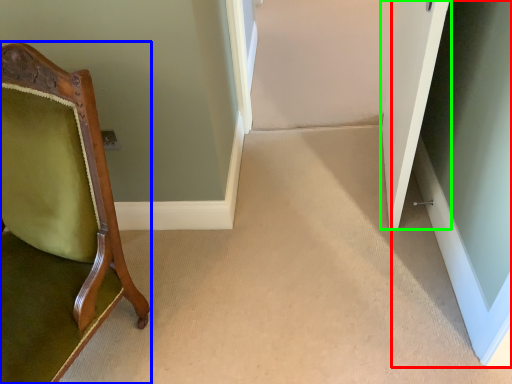
Question: Based on their relative distances, which object is farther from glass door (highlighted by a red box)? Choose from chair (highlighted by a blue box) and door (highlighted by a green box).

Choices:
 (A) chair
 (B) door

Answer: (A)